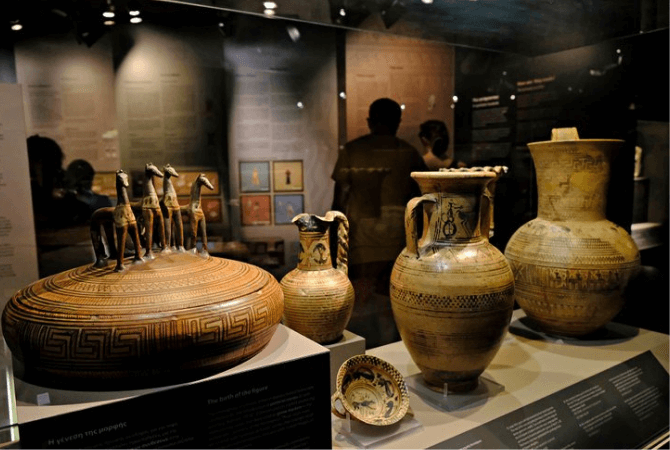
You are a GUI agent. You are given a task and a screenshot of the screen. Output one action in this format:
    pyautogui.click(x=<x>, y=<y>)
    Task: Click on the left ceramic vase
    The width and height of the screenshot is (670, 450).
    Given the screenshot: What is the action you would take?
    pyautogui.click(x=328, y=300)